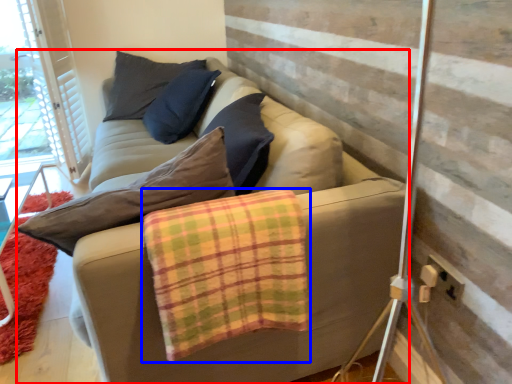
Question: Which point is closer to the camera, studio couch (highlighted by a red box) or blanket (highlighted by a blue box)?

Choices:
 (A) studio couch
 (B) blanket

Answer: (A)